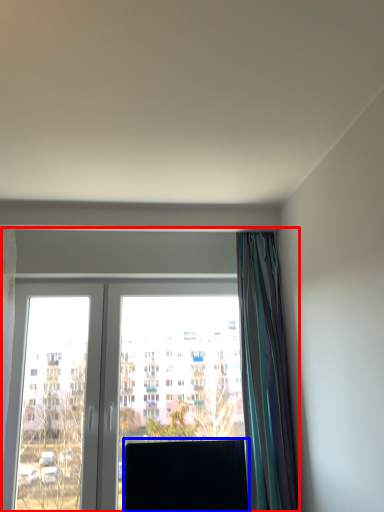
Question: Which object appears closest to the camera in this image, window (highlighted by a red box) or window screen (highlighted by a blue box)?

Choices:
 (A) window
 (B) window screen

Answer: (B)